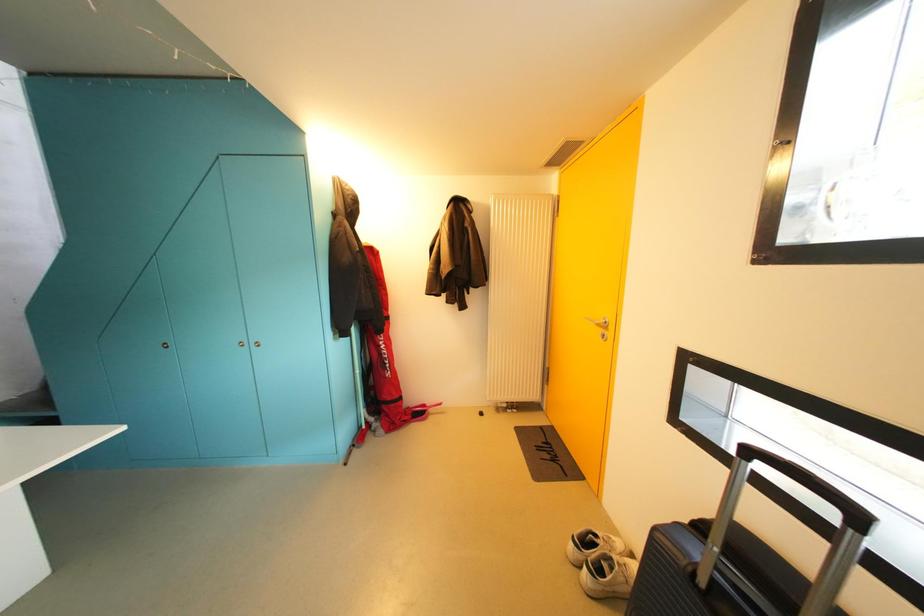
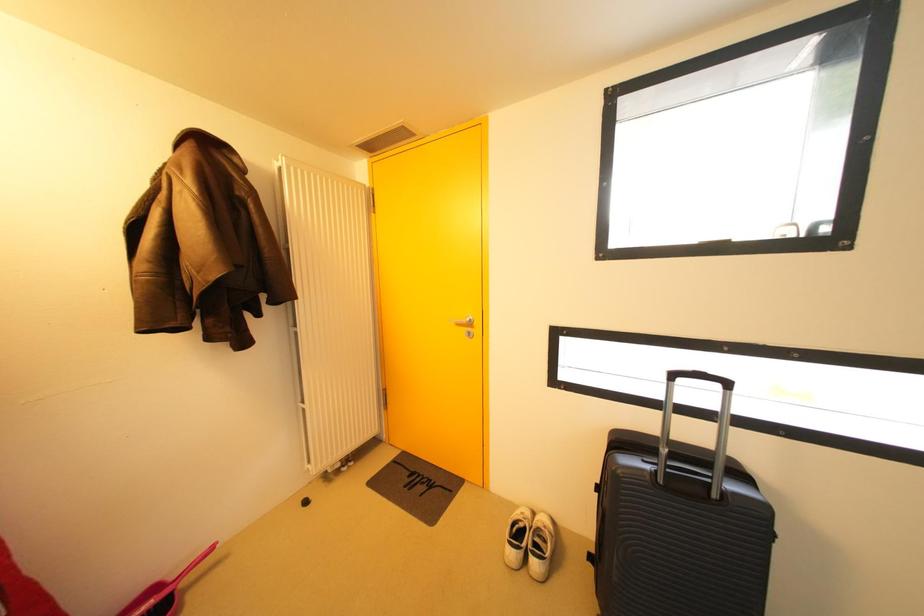
Question: The camera is either moving clockwise (left) or counter-clockwise (right) around the object. The first image is from the beginning of the video and the second image is from the end. Is the camera moving left or right when shooting the video?

Choices:
 (A) Left
 (B) Right

Answer: (A)